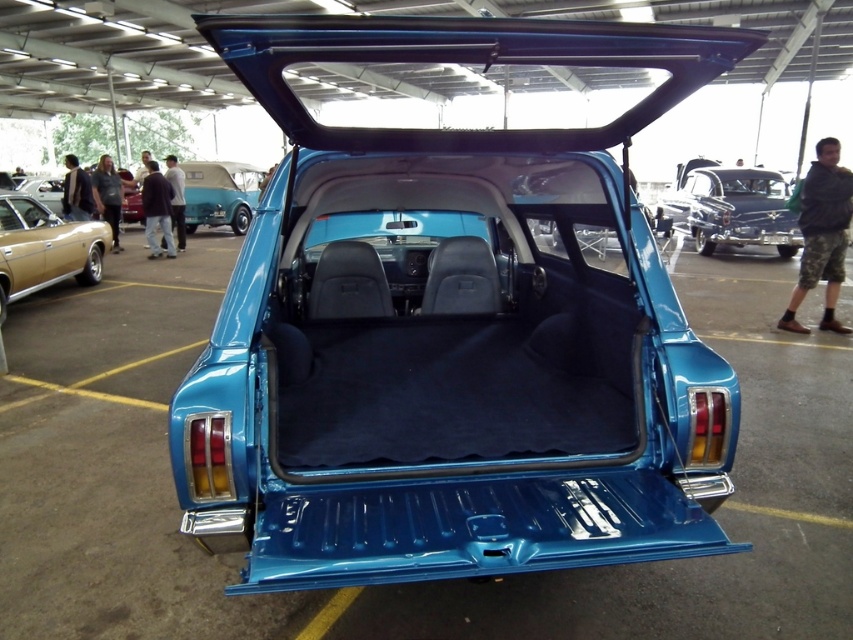
You are standing at the entrance of the parking area and want to locate the shiny blue sedan at center. According to the coordinates provided, where exactly is it positioned?

The shiny blue sedan at center is located at point coordinates 0.325 on the x axis and 0.857 on the y axis.

In the scene shown: You are standing in front of a shiny blue sedan at center and a matte black car at upper left. Which car is positioned lower in the image?

The shiny blue sedan at center is positioned lower than the matte black car at upper left.